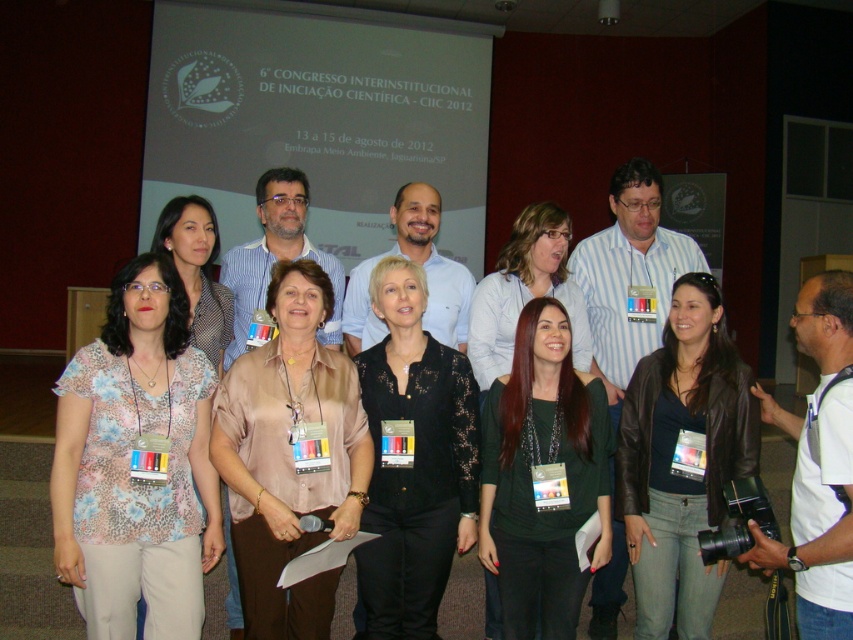
You are a photographer at the event and need to adjust the camera height to capture both the floral print blouse at center and the leather jacket at center in the same frame. Which object should you focus on to ensure both are visible?

The floral print blouse at center is not as tall as the leather jacket at center, so you should focus on the leather jacket at center to ensure both are visible in the frame.

You are a photographer at the event and need to adjust the lighting to ensure both the matte pink blouse at center and the matte brown blouse at center are well lit. Which blouse should you focus on first if you want to light the one that is lower in the frame?

The matte pink blouse at center is below the matte brown blouse at center, so you should focus on lighting the matte pink blouse at center first since it is lower in the frame.

You are organizing a photo shoot and need to arrange the matte pink blouse at center and the matte brown blouse at center based on their sizes. Which blouse should be placed first if you want to arrange them from smallest to largest?

The matte pink blouse at center should be placed first because it has a smaller size compared to the matte brown blouse at center.